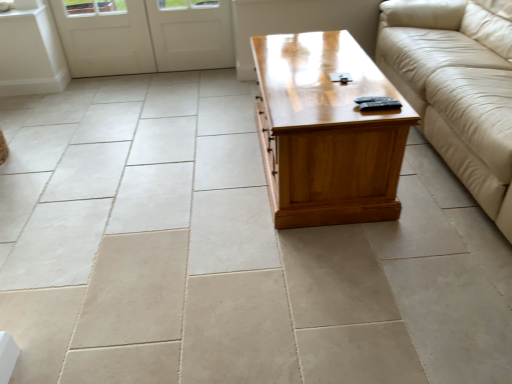
At what (x,y) coordinates should I click in order to perform the action: click on unoccupied area in front of light brown wood coffee table at center. Please return your answer as a coordinate pair (x, y). Looking at the image, I should click on (326, 278).